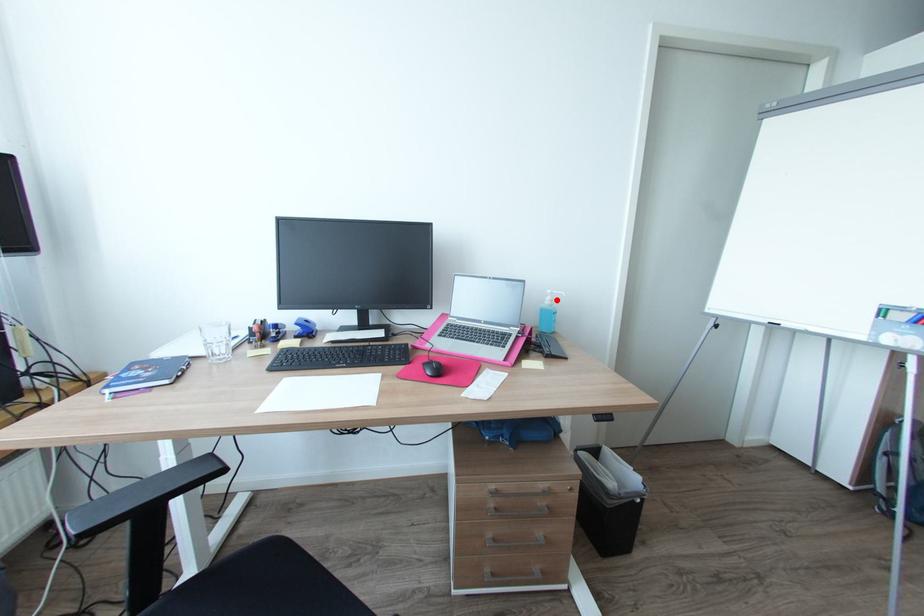
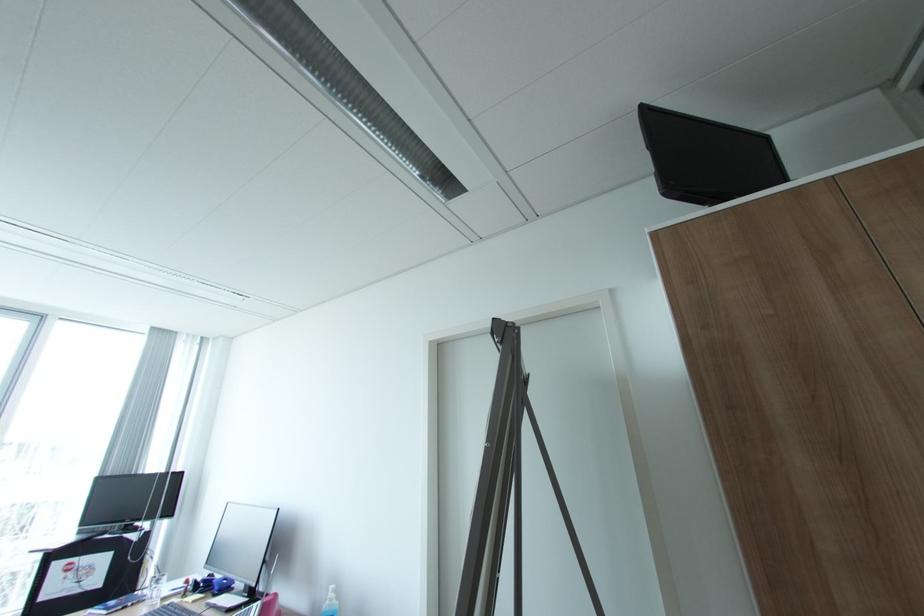
In the second image, find the point that corresponds to the highlighted location in the first image.

(336, 599)